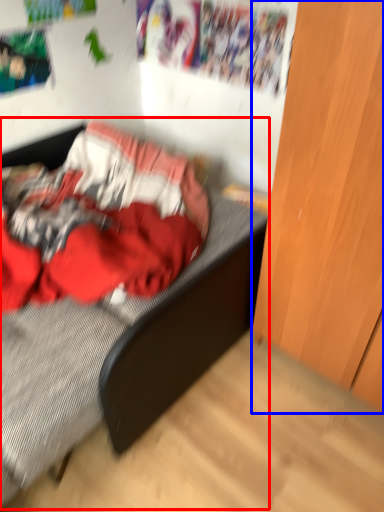
Question: Which object is further to the camera taking this photo, bed (highlighted by a red box) or dresser (highlighted by a blue box)?

Choices:
 (A) bed
 (B) dresser

Answer: (A)